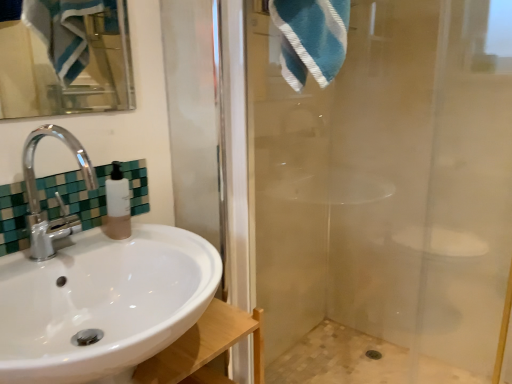
You are a GUI agent. You are given a task and a screenshot of the screen. Output one action in this format:
    pyautogui.click(x=<x>, y=<y>)
    Task: Click on the free location to the right of translucent plastic soap dispenser at sink
    
    Given the screenshot: What is the action you would take?
    pyautogui.click(x=164, y=243)